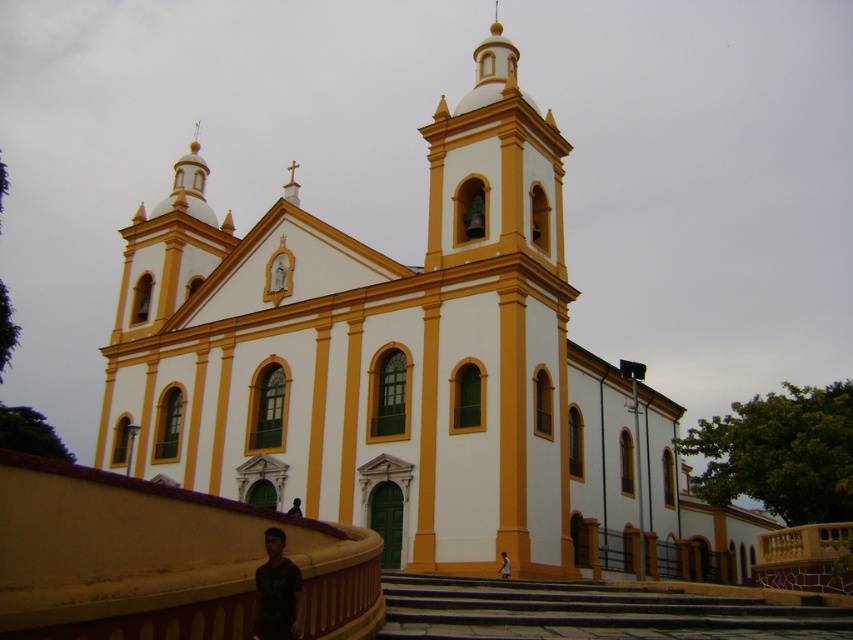
Looking at this image, you are standing in front of the colonial church and notice a black matte shirt at lower center. Where exactly is the black matte shirt positioned relative to the church facade?

The black matte shirt at lower center is located at point coordinates approximately 0.927 on the x axis and 0.326 on the y axis relative to the church facade.